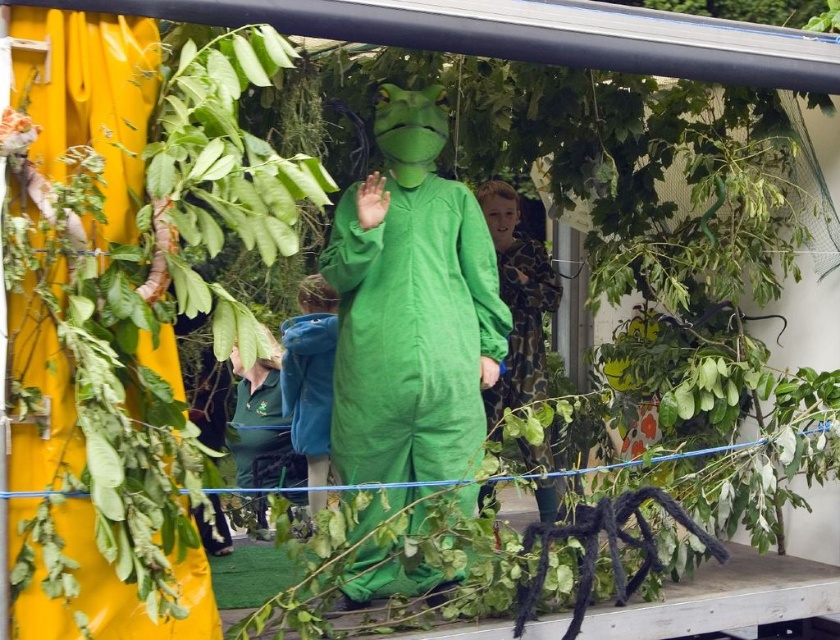
You are at the event and want to take a photo of both point [525,596] and point [306,337]. Since you can only focus on one point at a time, which point should you focus on first to ensure the other is still in the frame?

You should focus on point [525,596] first because it is in front of point [306,337], so focusing on the closer point will keep the background point in focus as well.

You are a photographer at the event and want to avoid capturing the black fuzzy spider at lower right in your photo. Which direction should you move your camera to ensure it doesn t appear in the frame?

Move the camera to the upper left direction away from the black fuzzy spider at lower right located at point (x=597, y=548).

You are a photographer at the event and need to ensure both the green matte costume at center and the blue velvet jacket at center are visible in the photo. Given their sizes, which one might you position closer to the camera to avoid blocking the other?

The green matte costume at center is much taller than the blue velvet jacket at center. To prevent the taller costume from blocking the shorter jacket, position the blue velvet jacket at center closer to the camera.